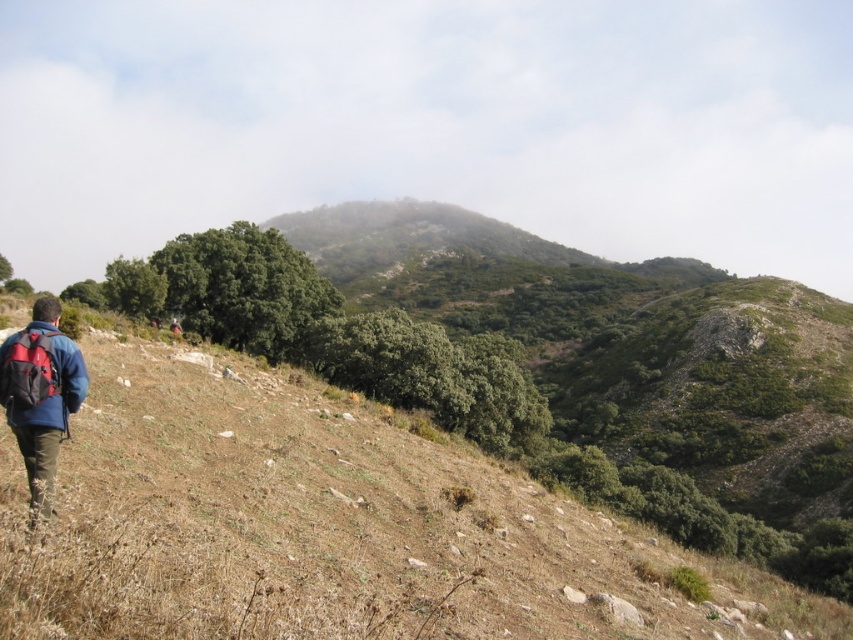
Is brown grassy hillside at lower left taller than red fabric backpack at lower left?

Yes, brown grassy hillside at lower left is taller than red fabric backpack at lower left.

Does point (221, 596) come farther from viewer compared to point (16, 337)?

That is False.

Locate an element on the screen. Image resolution: width=853 pixels, height=640 pixels. brown grassy hillside at lower left is located at coordinates (332, 528).

In the scene shown: Who is more distant from viewer, (163, 346) or (28, 413)?

The point (163, 346) is more distant.

Which is below, brown grassy hillside at lower left or blue fabric jacket at lower left?

brown grassy hillside at lower left is lower down.

Find the location of `brown grassy hillside at lower left`. brown grassy hillside at lower left is located at coordinates (332, 528).

From the picture: Can you confirm if blue fabric jacket at lower left is positioned to the left of red fabric backpack at lower left?

Yes, blue fabric jacket at lower left is to the left of red fabric backpack at lower left.

Does blue fabric jacket at lower left lie in front of red fabric backpack at lower left?

Yes, it is.

Does point (79, 360) come in front of point (42, 352)?

No, it is behind (42, 352).

This screenshot has height=640, width=853. Find the location of `blue fabric jacket at lower left`. blue fabric jacket at lower left is located at coordinates (39, 394).